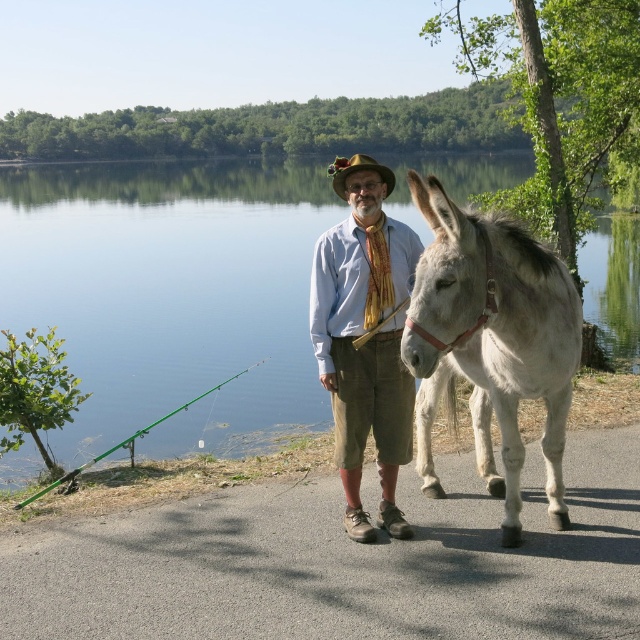
You are a photographer trying to capture the man in the scene. You notice the light blue corduroy shirt at center and the brown felt cowboy hat at center. Which item is located lower on his body?

The light blue corduroy shirt at center is positioned under the brown felt cowboy hat at center, so the light blue corduroy shirt at center is lower on his body.

You are a photographer trying to capture a clear shot of the light blue corduroy shirt at center. However, the gray matte donkey at right is blocking your view. Can you move the donkey to the side to get an unobstructed view of the shirt?

The gray matte donkey at right is in front of the light blue corduroy shirt at center, so moving the donkey to the side would allow you to see the light blue corduroy shirt at center without obstruction.

You are a tour guide leading a group near the lake. You need to ensure that visitors maintain a safe distance of at least 3 feet from the donkey for safety. Based on the scene, is the distance between the gray matte donkey at right and the light blue corduroy shirt at center sufficient to comply with the safety guideline?

The distance between the gray matte donkey at right and the light blue corduroy shirt at center is 3.31 feet, which exceeds the required 3 feet safety guideline. Therefore, the current distance complies with the safety requirement.